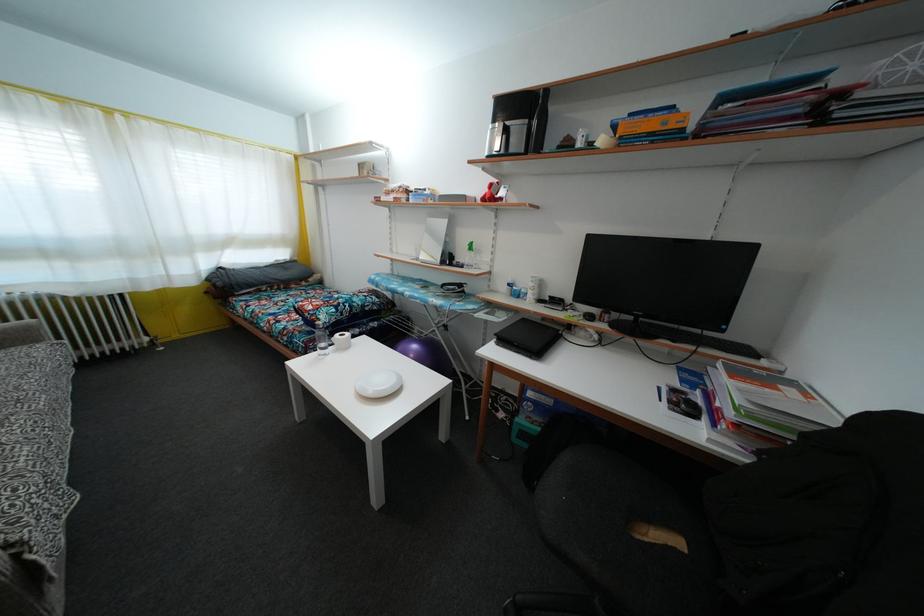
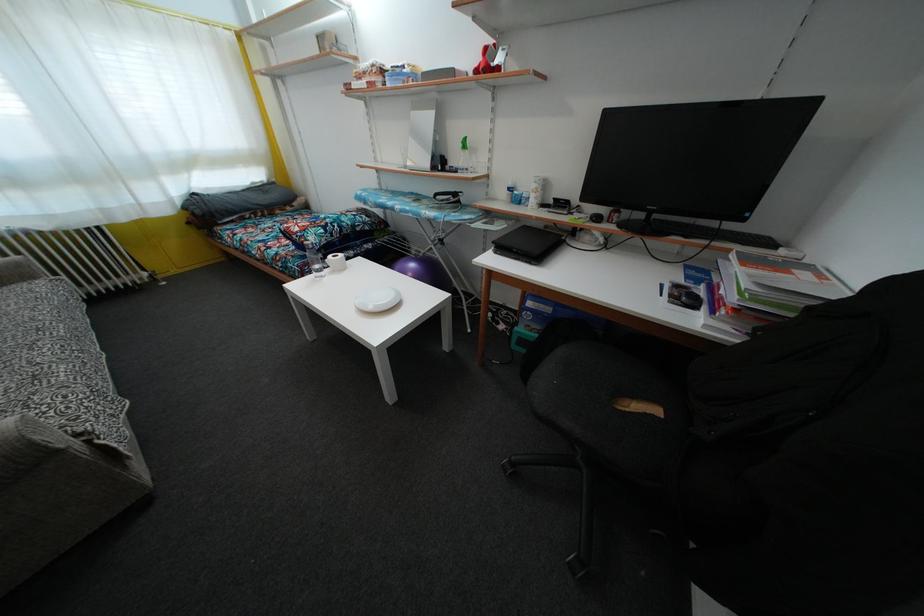
Locate, in the second image, the point that corresponds to point (315, 322) in the first image.

(305, 244)